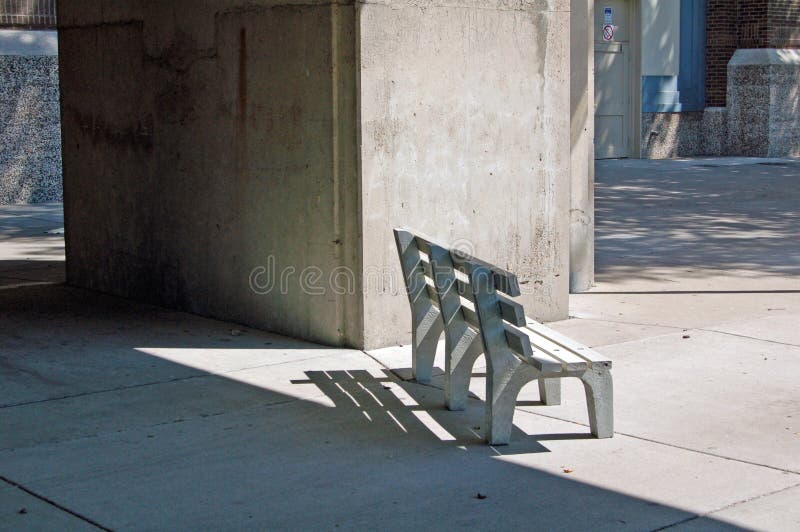
Where is `water stains`? water stains is located at coordinates (244, 57), (100, 138), (160, 51).